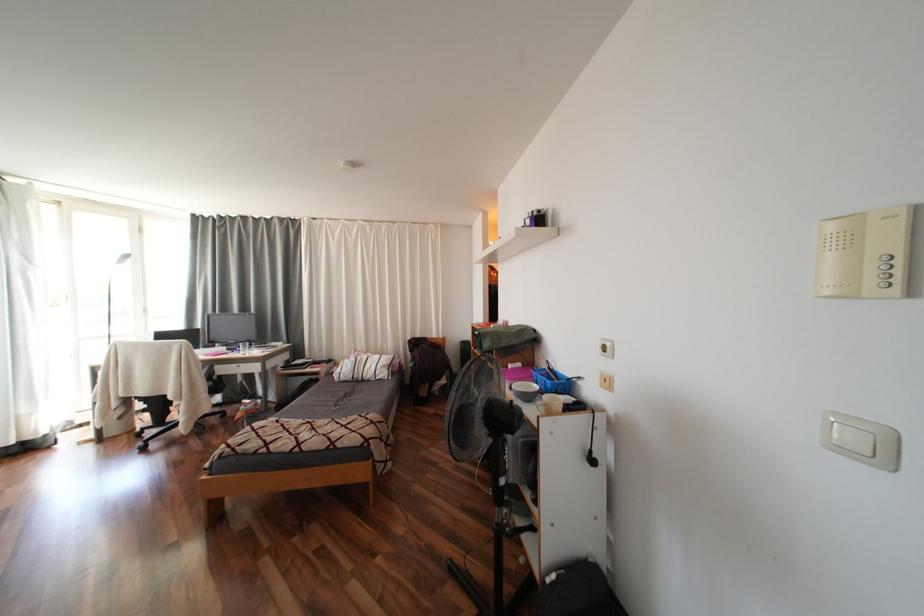
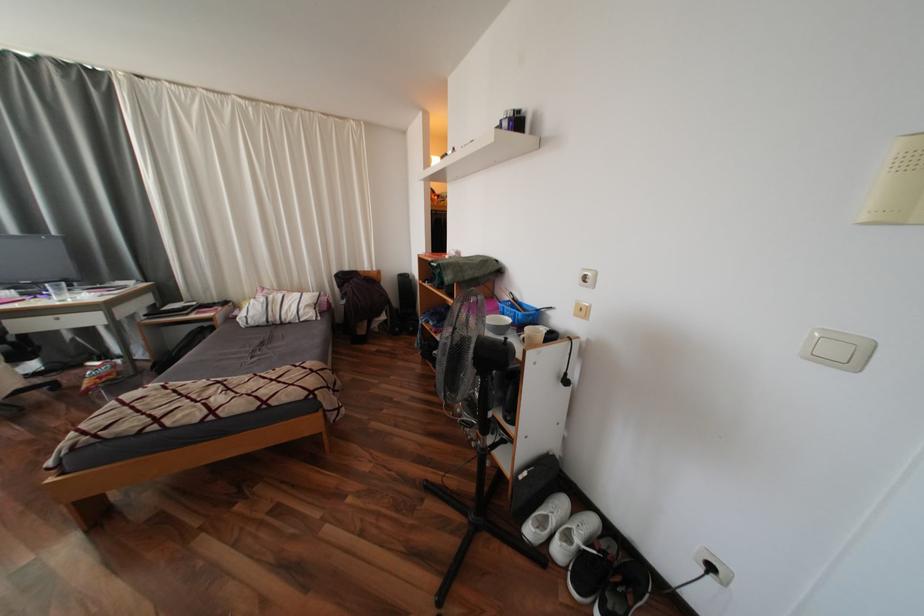
In a continuous first-person perspective shot, in which direction is the camera moving?

The cameraman moved toward left, forward.